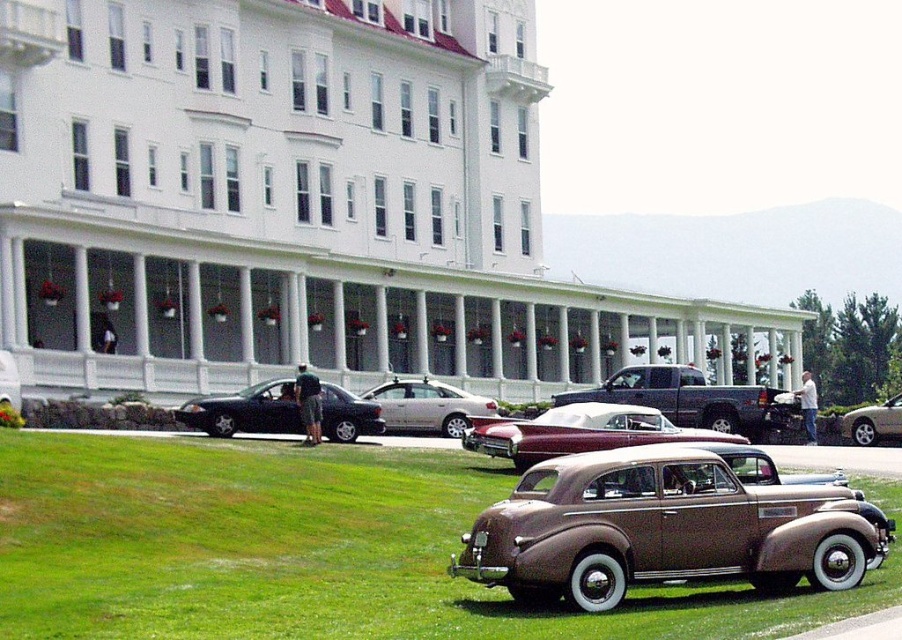
You are standing at the entrance of the large white building and want to park your car in the closest available spot. The shiny gold sedan at center is blocking the path to the parking area. Can you determine if there is space to maneuver around it?

The shiny gold sedan at center is located at point (661, 529). Since the coordinates indicate its position relative to the entrance, you can likely maneuver around it by moving either to the left or right side of the sedan to access the parking area.

You are a tour guide leading a group of visitors to the building. You want to point out the two vintage cars parked in front of the building. Which car is bigger between the maroon leather convertible at center and the silver metallic sedan at center?

The maroon leather convertible at center is larger in size compared to the silver metallic sedan at center.

You are a visitor standing in front of the building and want to take a photo of both the brown metallic car at center and the shiny silver sedan at center. Which car should you move towards first to ensure both are in the frame?

You should move towards the brown metallic car at center first because it is closer to you than the shiny silver sedan at center, so adjusting your position near it will help include both cars in the photo.